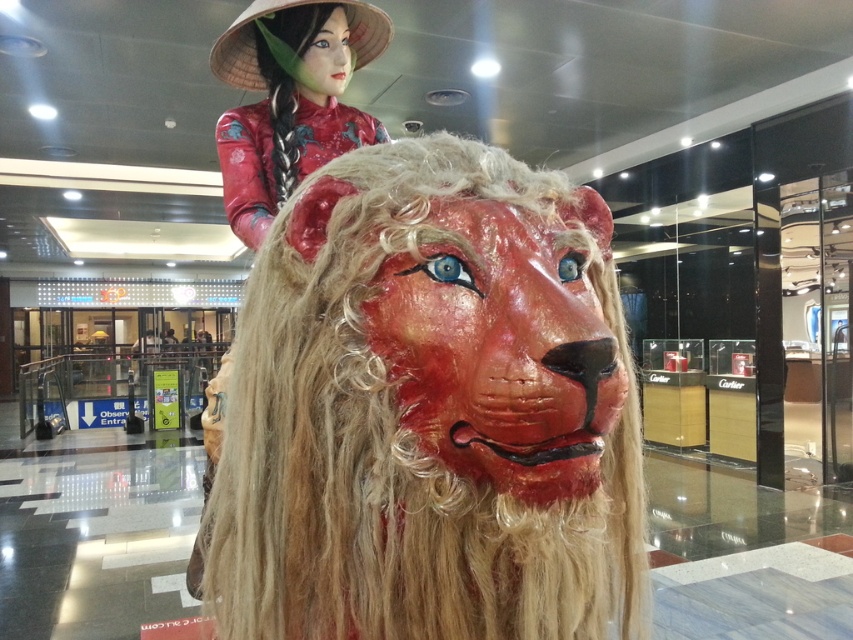
Measure the distance between matte red lion head at center and camera.

The distance of matte red lion head at center from camera is 23.11 inches.

From the picture: Does matte red lion head at center have a greater height compared to matte red silk doll at upper center?

Yes, matte red lion head at center is taller than matte red silk doll at upper center.

Does point (426, 182) come closer to viewer compared to point (287, 129)?

Yes, point (426, 182) is closer to viewer.

At what (x,y) coordinates should I click in order to perform the action: click on matte red lion head at center. Please return your answer as a coordinate pair (x, y). The width and height of the screenshot is (853, 640). Looking at the image, I should click on (430, 412).